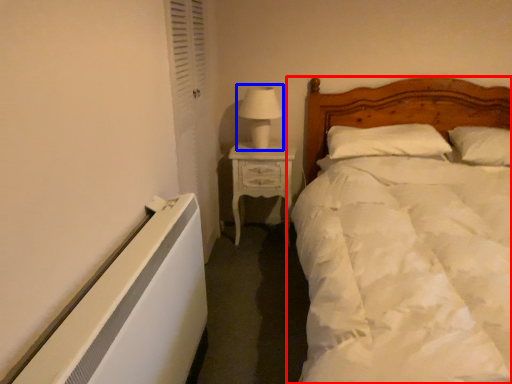
Question: Which object appears closest to the camera in this image, bed (highlighted by a red box) or table lamp (highlighted by a blue box)?

Choices:
 (A) bed
 (B) table lamp

Answer: (A)